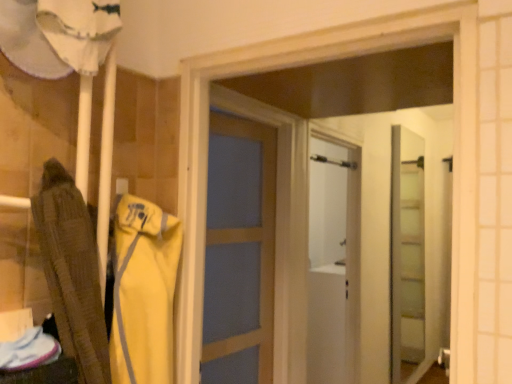
Question: Is clear glass door at center positioned far away from yellow fabric at left?

Choices:
 (A) yes
 (B) no

Answer: (A)

Question: From a real-world perspective, is clear glass door at center on yellow fabric at left?

Choices:
 (A) yes
 (B) no

Answer: (B)

Question: Is clear glass door at center at the left side of yellow fabric at left?

Choices:
 (A) yes
 (B) no

Answer: (B)

Question: Is clear glass door at center thinner than yellow fabric at left?

Choices:
 (A) yes
 (B) no

Answer: (A)

Question: Considering the relative sizes of clear glass door at center and yellow fabric at left in the image provided, is clear glass door at center wider than yellow fabric at left?

Choices:
 (A) yes
 (B) no

Answer: (B)

Question: Is clear glass door at center completely or partially outside of yellow fabric at left?

Choices:
 (A) no
 (B) yes

Answer: (B)

Question: From a real-world perspective, is yellow fabric at left located beneath clear glass door at center?

Choices:
 (A) no
 (B) yes

Answer: (A)

Question: Does yellow fabric at left have a lesser height compared to clear glass door at center?

Choices:
 (A) yes
 (B) no

Answer: (A)

Question: Is yellow fabric at left facing towards clear glass door at center?

Choices:
 (A) yes
 (B) no

Answer: (B)

Question: From a real-world perspective, is yellow fabric at left on top of clear glass door at center?

Choices:
 (A) yes
 (B) no

Answer: (A)

Question: From the image's perspective, would you say yellow fabric at left is shown under clear glass door at center?

Choices:
 (A) yes
 (B) no

Answer: (B)

Question: Is the depth of yellow fabric at left less than that of clear glass door at center?

Choices:
 (A) no
 (B) yes

Answer: (B)

Question: Choose the correct answer: Is clear glass door at center inside yellow fabric at left or outside it?

Choices:
 (A) inside
 (B) outside

Answer: (B)